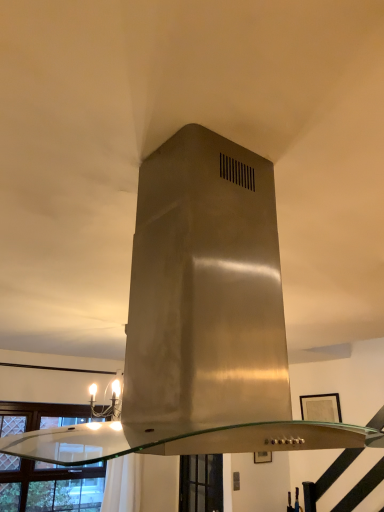
Question: Should I look upward or downward to see clear glass window at lower left, which is counted as the 1th window, starting from the left?

Choices:
 (A) down
 (B) up

Answer: (A)

Question: From a real-world perspective, is clear glass window at lower left, placed as the 2th window when sorted from right to left, positioned under clear glass window at lower center, which is counted as the 2th window, starting from the left, based on gravity?

Choices:
 (A) yes
 (B) no

Answer: (B)

Question: Is clear glass window at lower left, which is counted as the 1th window, starting from the left, to the right of clear glass window at lower center, which is counted as the 2th window, starting from the left, from the viewer's perspective?

Choices:
 (A) yes
 (B) no

Answer: (B)

Question: Is clear glass window at lower left, placed as the 2th window when sorted from right to left, taller than clear glass window at lower center, which is counted as the 2th window, starting from the left?

Choices:
 (A) yes
 (B) no

Answer: (A)

Question: Considering the relative positions of clear glass window at lower left, placed as the 2th window when sorted from right to left, and clear glass window at lower center, positioned as the first window in right-to-left order, in the image provided, is clear glass window at lower left, placed as the 2th window when sorted from right to left, behind clear glass window at lower center, positioned as the first window in right-to-left order,?

Choices:
 (A) yes
 (B) no

Answer: (B)

Question: Can you confirm if clear glass window at lower left, placed as the 2th window when sorted from right to left, is smaller than clear glass window at lower center, which is counted as the 2th window, starting from the left?

Choices:
 (A) yes
 (B) no

Answer: (B)

Question: From the image's perspective, is clear glass window at lower left, placed as the 2th window when sorted from right to left, under clear glass window at lower center, positioned as the first window in right-to-left order?

Choices:
 (A) no
 (B) yes

Answer: (A)

Question: From a real-world perspective, is clear glass window at lower center, positioned as the first window in right-to-left order, positioned over clear glass window at lower left, which is counted as the 1th window, starting from the left, based on gravity?

Choices:
 (A) yes
 (B) no

Answer: (B)

Question: Is clear glass window at lower center, positioned as the first window in right-to-left order, positioned before clear glass window at lower left, which is counted as the 1th window, starting from the left?

Choices:
 (A) no
 (B) yes

Answer: (A)

Question: Is clear glass window at lower center, which is counted as the 2th window, starting from the left, positioned with its back to clear glass window at lower left, which is counted as the 1th window, starting from the left?

Choices:
 (A) yes
 (B) no

Answer: (B)

Question: Are clear glass window at lower center, which is counted as the 2th window, starting from the left, and clear glass window at lower left, placed as the 2th window when sorted from right to left, located far from each other?

Choices:
 (A) yes
 (B) no

Answer: (A)

Question: Would you say clear glass window at lower center, positioned as the first window in right-to-left order, is outside clear glass window at lower left, which is counted as the 1th window, starting from the left?

Choices:
 (A) yes
 (B) no

Answer: (A)

Question: Does clear glass window at lower center, which is counted as the 2th window, starting from the left, appear on the right side of clear glass window at lower left, placed as the 2th window when sorted from right to left?

Choices:
 (A) no
 (B) yes

Answer: (B)

Question: In the image, is clear glass window at lower center, positioned as the first window in right-to-left order, positioned in front of or behind clear glass window at lower left, which is counted as the 1th window, starting from the left?

Choices:
 (A) front
 (B) behind

Answer: (B)